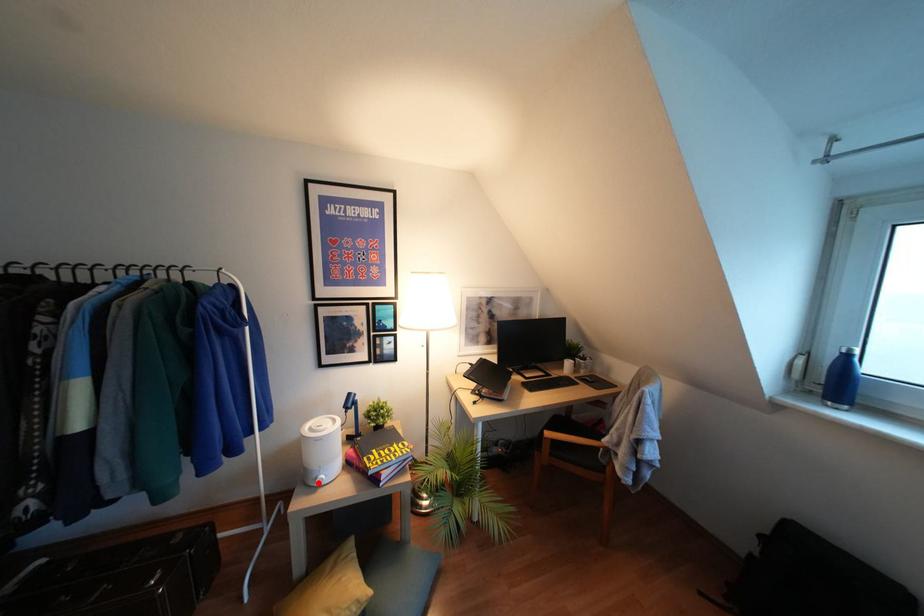
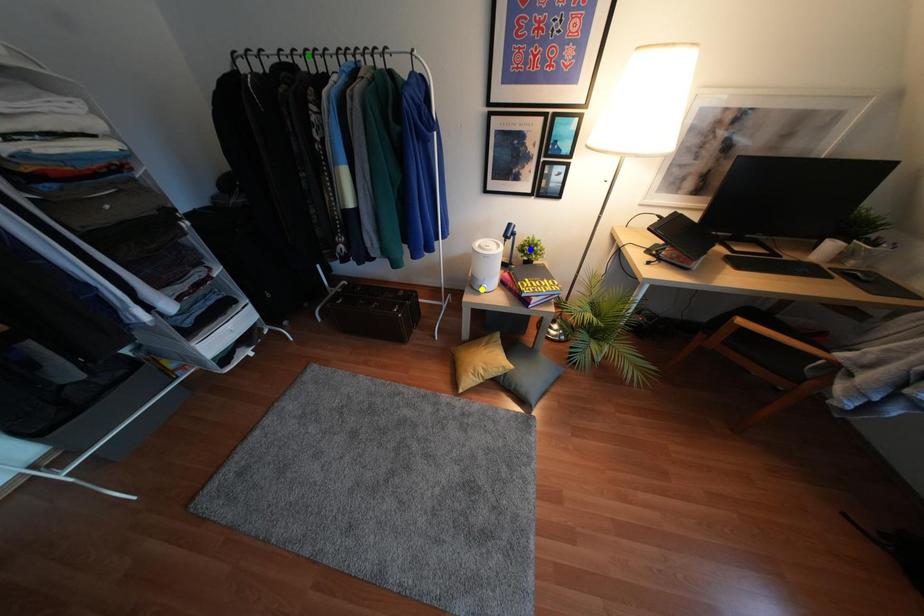
Question: I am providing you with two images of the same scene from different viewpoints. A red point is marked on the first image. You are given multiple points on the second image. Can you choose the point in image 2 that corresponds to the point in image 1?

Choices:
 (A) green point
 (B) blue point
 (C) yellow point

Answer: (C)